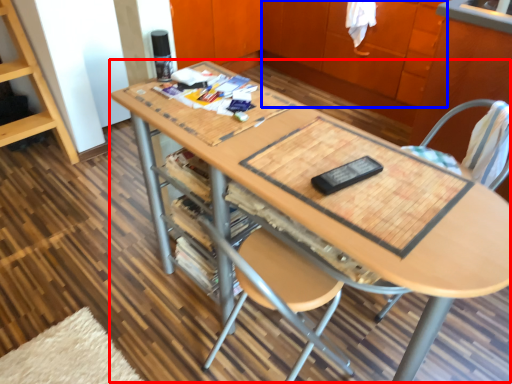
Question: Which of the following is the closest to the observer, table (highlighted by a red box) or cabinetry (highlighted by a blue box)?

Choices:
 (A) table
 (B) cabinetry

Answer: (A)